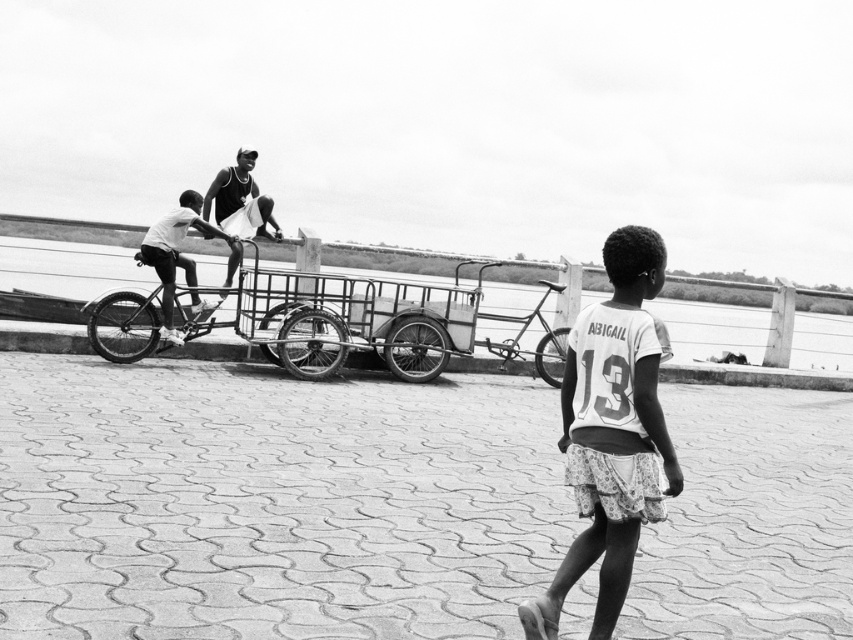
Question: Does white fabric shirt at center appear on the left side of metallic wire cart at center?

Choices:
 (A) yes
 (B) no

Answer: (B)

Question: Which object is positioned closest to the metallic wire cart at center?

Choices:
 (A) metallic silver bicycle at center
 (B) white fabric shirt at center
 (C) matte black tank top at upper center
 (D) dark gray fabric shirt at center

Answer: (A)

Question: Which point is farther from the camera taking this photo?

Choices:
 (A) (178, 212)
 (B) (619, 589)
 (C) (328, 356)

Answer: (C)

Question: Does metallic silver bicycle at center have a smaller size compared to dark gray fabric shirt at center?

Choices:
 (A) yes
 (B) no

Answer: (B)

Question: Considering the real-world distances, which object is closest to the metallic wire cart at center?

Choices:
 (A) matte black tank top at upper center
 (B) metallic silver bicycle at center
 (C) dark gray fabric shirt at center

Answer: (B)

Question: Is metallic silver bicycle at center wider than dark gray fabric shirt at center?

Choices:
 (A) no
 (B) yes

Answer: (B)